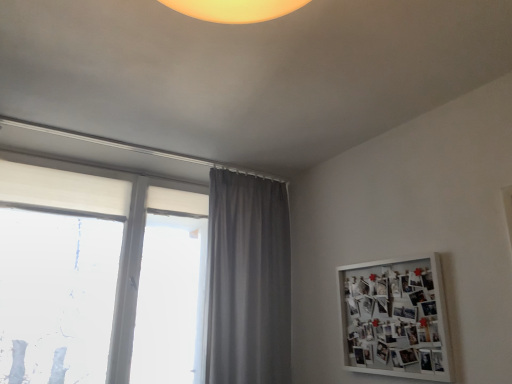
Question: Considering their positions, is gray fabric curtain at center located in front of or behind white matte window at left?

Choices:
 (A) front
 (B) behind

Answer: (B)

Question: From the image's perspective, is gray fabric curtain at center above or below white matte window at left?

Choices:
 (A) above
 (B) below

Answer: (B)

Question: Considering the real-world distances, which object is farthest from the gray fabric curtain at center?

Choices:
 (A) white matte window at left
 (B) white matte bulletin board at upper right

Answer: (B)

Question: Which is nearer to the white matte bulletin board at upper right?

Choices:
 (A) white matte window at left
 (B) gray fabric curtain at center

Answer: (B)